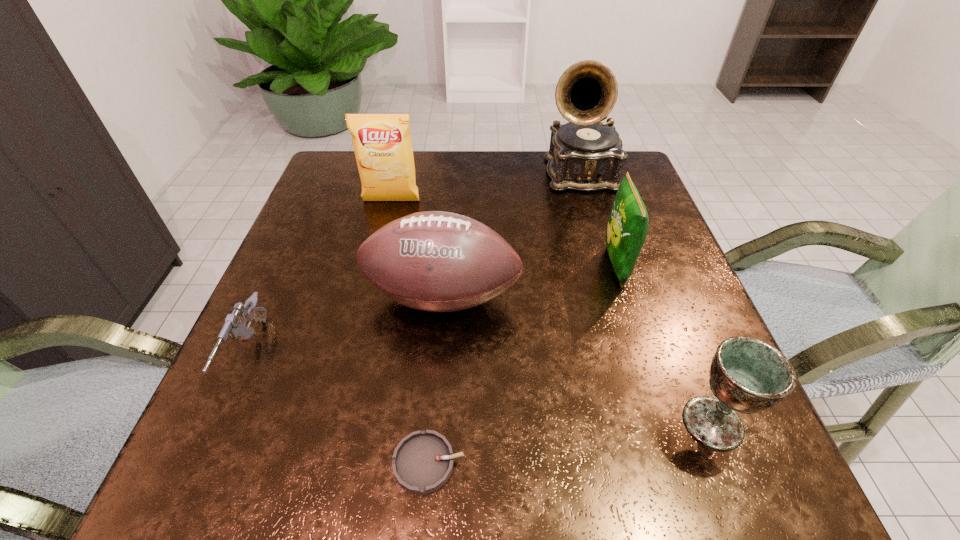
Find the location of a particular element. The image size is (960, 540). phonograph record is located at coordinates (585, 154).

The height and width of the screenshot is (540, 960). In order to click on the farther crisp (potato chip) in this screenshot , I will do `click(382, 143)`.

The image size is (960, 540). Find the location of `the taller crisp (potato chip)`. the taller crisp (potato chip) is located at coordinates (382, 143).

Find the location of a particular element. Image resolution: width=960 pixels, height=540 pixels. football (American) is located at coordinates click(436, 261).

This screenshot has width=960, height=540. Identify the location of the shorter crisp (potato chip). (627, 228).

You are a GUI agent. You are given a task and a screenshot of the screen. Output one action in this format:
    pyautogui.click(x=<x>, y=<y>)
    Task: Click on the right crisp (potato chip)
    Image resolution: width=960 pixels, height=540 pixels.
    Given the screenshot: What is the action you would take?
    pyautogui.click(x=627, y=228)

Image resolution: width=960 pixels, height=540 pixels. I want to click on chalice, so click(747, 375).

You are a GUI agent. You are given a task and a screenshot of the screen. Output one action in this format:
    pyautogui.click(x=<x>, y=<y>)
    Task: Click on the gun
    The height and width of the screenshot is (540, 960).
    Given the screenshot: What is the action you would take?
    pyautogui.click(x=235, y=324)

I want to click on the leftmost object, so click(235, 324).

The height and width of the screenshot is (540, 960). Identify the location of ashtray. (423, 461).